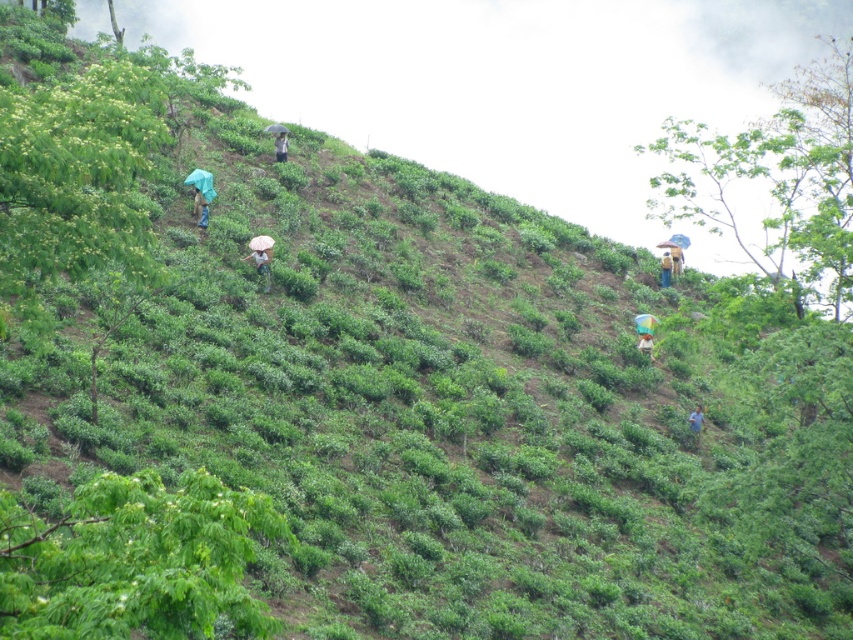
Is blue fabric umbrella at lower right to the left of light brown fabric at center from the viewer's perspective?

In fact, blue fabric umbrella at lower right is to the right of light brown fabric at center.

Measure the distance between blue fabric umbrella at lower right and light brown fabric at center.

3.39 meters

Is point (689, 428) positioned before point (651, 336)?

Yes.

Locate an element on the screen. blue fabric umbrella at lower right is located at coordinates (695, 420).

Does blue fabric umbrella at upper right appear under blue fabric umbrella at lower right?

No.

Looking at this image, is blue fabric umbrella at upper right positioned before blue fabric umbrella at lower right?

No, blue fabric umbrella at upper right is behind blue fabric umbrella at lower right.

This screenshot has width=853, height=640. I want to click on blue fabric umbrella at upper right, so click(x=665, y=268).

Who is more distant from viewer, (202, 196) or (277, 141)?

Point (277, 141)

Is point (199, 209) farther from camera compared to point (280, 161)?

No, it is not.

The image size is (853, 640). I want to click on green fabric umbrella at upper left, so 200,209.